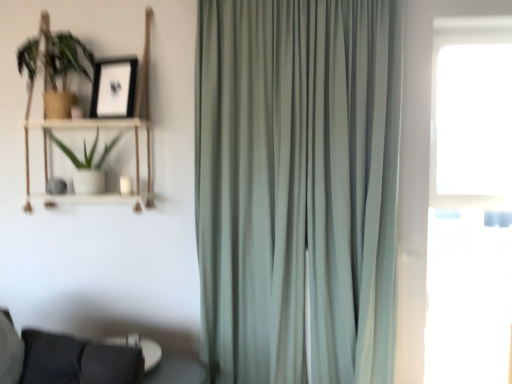
What do you see at coordinates (470, 202) in the screenshot? This screenshot has height=384, width=512. I see `transparent glass window at right` at bounding box center [470, 202].

Describe the element at coordinates (91, 121) in the screenshot. I see `woodenobject at left` at that location.

Locate an element on the screen. This screenshot has height=384, width=512. satin green curtain at center is located at coordinates (297, 187).

This screenshot has width=512, height=384. What do you see at coordinates (55, 66) in the screenshot?
I see `green matte plant at upper left, the 2th houseplant ordered from the bottom` at bounding box center [55, 66].

Measure the distance between point [115,59] and camera.

The distance of point [115,59] from camera is 2.54 meters.

The height and width of the screenshot is (384, 512). Find the location of `transparent glass window at right`. transparent glass window at right is located at coordinates (470, 202).

In the scene shown: From the image's perspective, is satin green curtain at center under black matte picture frame at upper left?

Yes.

Image resolution: width=512 pixels, height=384 pixels. What are the coordinates of `picture frame behind the satin green curtain at center` in the screenshot? It's located at (114, 87).

Is satin green curtain at center to the left or to the right of black matte picture frame at upper left in the image?

Clearly, satin green curtain at center is on the right of black matte picture frame at upper left in the image.

Would you say satin green curtain at center contains black matte picture frame at upper left?

No, black matte picture frame at upper left is not a part of satin green curtain at center.

Which object is positioned more to the right, black matte picture frame at upper left or woodenobject at left?

Positioned to the right is black matte picture frame at upper left.

Considering their positions, is black matte picture frame at upper left located in front of or behind woodenobject at left?

black matte picture frame at upper left is positioned farther from the viewer than woodenobject at left.

Is point (126, 58) behind point (117, 116)?

Yes, point (126, 58) is farther from viewer.

Is woodenobject at left at the back of black matte picture frame at upper left?

Yes, woodenobject at left is at the back of black matte picture frame at upper left.

Can we say white matte pot at left, marked as the 2th houseplant in a top-to-bottom arrangement, lies outside satin green curtain at center?

That's correct, white matte pot at left, marked as the 2th houseplant in a top-to-bottom arrangement, is outside of satin green curtain at center.

Which of these two, white matte pot at left, marked as the 2th houseplant in a top-to-bottom arrangement, or satin green curtain at center, stands taller?

satin green curtain at center is taller.

Is white matte pot at left, the first houseplant ordered from the bottom, looking in the opposite direction of satin green curtain at center?

white matte pot at left, the first houseplant ordered from the bottom, does not have its back to satin green curtain at center.

From the image's perspective, is satin green curtain at center under white matte pot at left, the first houseplant ordered from the bottom?

Yes, from the image's perspective, satin green curtain at center is below white matte pot at left, the first houseplant ordered from the bottom.

Could you measure the distance between satin green curtain at center and white matte pot at left, the first houseplant ordered from the bottom?

satin green curtain at center and white matte pot at left, the first houseplant ordered from the bottom, are 3.62 feet apart.

Image resolution: width=512 pixels, height=384 pixels. What are the coordinates of `curtain below the white matte pot at left, the first houseplant ordered from the bottom (from a real-world perspective)` in the screenshot? It's located at (297, 187).

From the image's perspective, which object appears higher, black matte picture frame at upper left or green matte plant at upper left, the first houseplant from the top?

green matte plant at upper left, the first houseplant from the top, is shown above in the image.

Considering their positions, is black matte picture frame at upper left located in front of or behind green matte plant at upper left, the 2th houseplant ordered from the bottom?

black matte picture frame at upper left is behind green matte plant at upper left, the 2th houseplant ordered from the bottom.

Is green matte plant at upper left, the first houseplant from the top, at the back of black matte picture frame at upper left?

No.

Is black matte picture frame at upper left at the right side of green matte plant at upper left, the 2th houseplant ordered from the bottom?

Yes, black matte picture frame at upper left is to the right of green matte plant at upper left, the 2th houseplant ordered from the bottom.

Would you consider satin green curtain at center to be distant from woodenobject at left?

No.

From a real-world perspective, between satin green curtain at center and woodenobject at left, who is vertically lower?

In real-world perspective, satin green curtain at center is lower.

Based on their sizes in the image, would you say satin green curtain at center is bigger or smaller than woodenobject at left?

In the image, satin green curtain at center appears to be larger than woodenobject at left.

In terms of height, does green matte plant at upper left, the first houseplant from the top, look taller or shorter compared to black matte picture frame at upper left?

Considering their sizes, green matte plant at upper left, the first houseplant from the top, has more height than black matte picture frame at upper left.

Which is behind, green matte plant at upper left, the 2th houseplant ordered from the bottom, or black matte picture frame at upper left?

Positioned behind is black matte picture frame at upper left.

From the picture: Is black matte picture frame at upper left at the back of green matte plant at upper left, the 2th houseplant ordered from the bottom?

No, green matte plant at upper left, the 2th houseplant ordered from the bottom, is not facing the opposite direction of black matte picture frame at upper left.

At what (x,y) coordinates should I click in order to perform the action: click on picture frame below the green matte plant at upper left, the 2th houseplant ordered from the bottom (from the image's perspective). Please return your answer as a coordinate pair (x, y). The width and height of the screenshot is (512, 384). Looking at the image, I should click on (114, 87).

Find the location of a particular element. This screenshot has width=512, height=384. curtain in front of the black matte picture frame at upper left is located at coordinates (297, 187).

The width and height of the screenshot is (512, 384). What are the coordinates of `picture frame on the right side of woodenobject at left` in the screenshot? It's located at (114, 87).

Considering their positions, is woodenobject at left positioned closer to satin green curtain at center than black matte picture frame at upper left?

woodenobject at left is closer to satin green curtain at center.

From the image, which object appears to be farther from woodenobject at left, satin green curtain at center or black matte picture frame at upper left?

satin green curtain at center.

Based on the photo, from the image, which object appears to be farther from satin green curtain at center, green matte plant at upper left, the 2th houseplant ordered from the bottom, or woodenobject at left?

Among the two, green matte plant at upper left, the 2th houseplant ordered from the bottom, is located further to satin green curtain at center.

Based on their spatial positions, is green matte plant at upper left, the 2th houseplant ordered from the bottom, or satin green curtain at center further from transparent glass window at right?

The object further to transparent glass window at right is green matte plant at upper left, the 2th houseplant ordered from the bottom.

Based on their spatial positions, is white matte pot at left, the first houseplant ordered from the bottom, or transparent glass window at right further from black matte picture frame at upper left?

transparent glass window at right is positioned further to the anchor black matte picture frame at upper left.

Based on their spatial positions, is black matte picture frame at upper left or white matte pot at left, marked as the 2th houseplant in a top-to-bottom arrangement, closer to transparent glass window at right?

black matte picture frame at upper left is closer to transparent glass window at right.

Based on their spatial positions, is transparent glass window at right or woodenobject at left further from white matte pot at left, marked as the 2th houseplant in a top-to-bottom arrangement?

Among the two, transparent glass window at right is located further to white matte pot at left, marked as the 2th houseplant in a top-to-bottom arrangement.

Looking at the image, which one is located closer to black matte picture frame at upper left, transparent glass window at right or woodenobject at left?

Based on the image, woodenobject at left appears to be nearer to black matte picture frame at upper left.

Identify the location of bookshelf between green matte plant at upper left, the first houseplant from the top, and satin green curtain at center. The image size is (512, 384). (91, 121).

Where is `curtain located between green matte plant at upper left, the first houseplant from the top, and transparent glass window at right in the left-right direction`? curtain located between green matte plant at upper left, the first houseplant from the top, and transparent glass window at right in the left-right direction is located at coordinates (297, 187).

I want to click on picture frame between green matte plant at upper left, the 2th houseplant ordered from the bottom, and white matte pot at left, the first houseplant ordered from the bottom, from top to bottom, so [114, 87].

At what (x,y) coordinates should I click in order to perform the action: click on picture frame between woodenobject at left and satin green curtain at center. Please return your answer as a coordinate pair (x, y). This screenshot has width=512, height=384. Looking at the image, I should click on (114, 87).